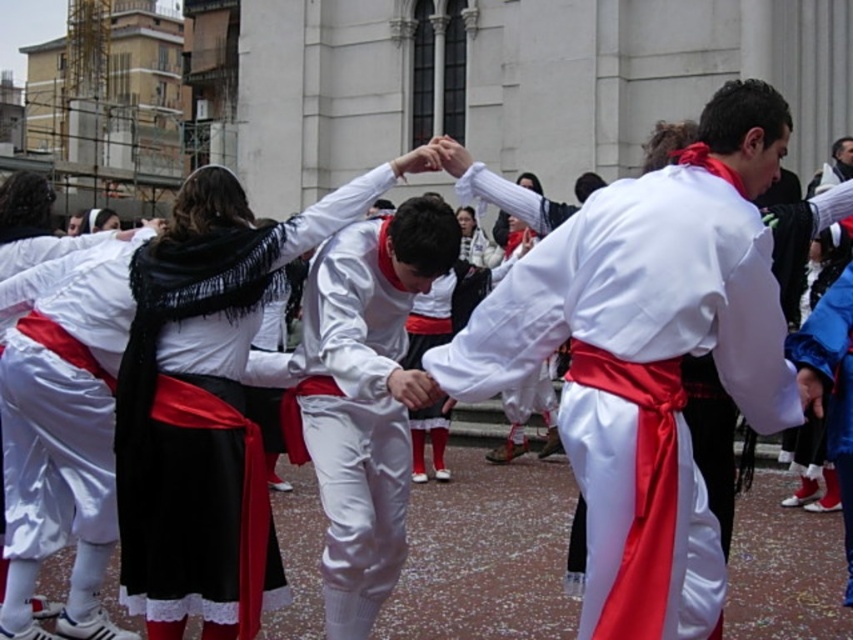
You are a photographer at the event, and you need to capture a photo of the participants wearing the satin white robe at center and the white satin pants at center. From which side should you position yourself to ensure both items are visible in the frame?

The satin white robe at center is positioned on the right side of white satin pants at center, so positioning yourself to the left side of the participants will ensure both items are visible in the frame.

You are a photographer trying to capture the details of the matte black robe at center and the white satin pants at center. Since both are at the center, how can you determine which one is closer to the camera?

The matte black robe at center is positioned over the white satin pants at center, so the robe is closer to the camera than the pants.